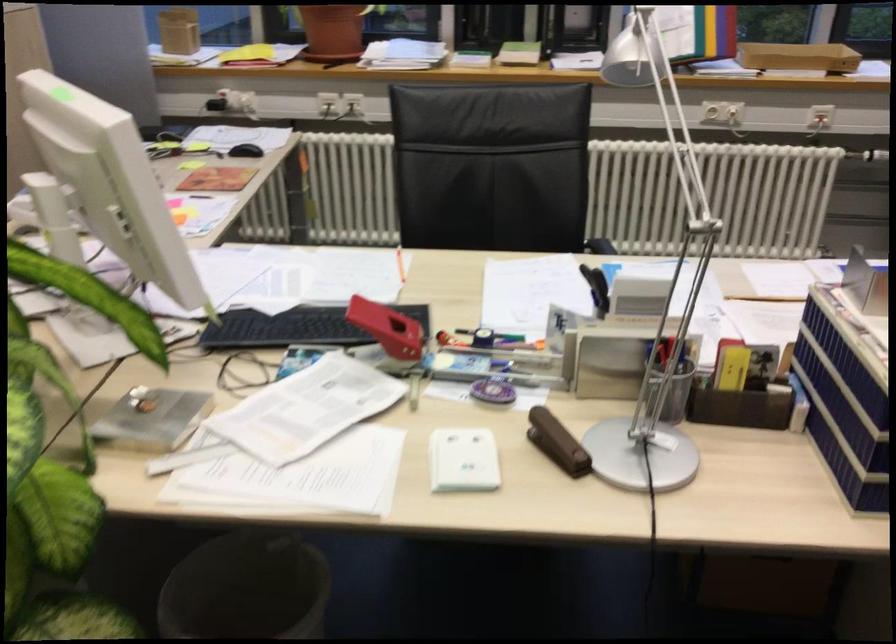
Where would you press the red hole puncher lever? Please return your answer as a coordinate pair (x, y).

(388, 328)